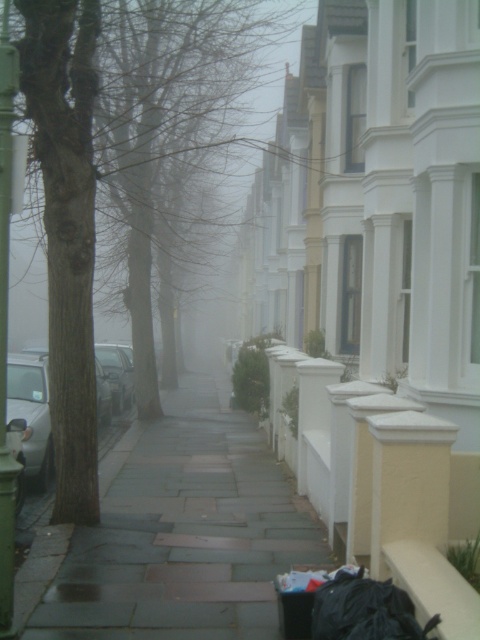
Question: Does dark gray stone pavement at center appear under brown rough tree at left?

Choices:
 (A) no
 (B) yes

Answer: (B)

Question: Is dark gray stone pavement at center in front of brown rough tree at left?

Choices:
 (A) no
 (B) yes

Answer: (A)

Question: Can you confirm if dark gray stone pavement at center is positioned to the right of brown rough tree at left?

Choices:
 (A) yes
 (B) no

Answer: (A)

Question: Which point is closer to the camera?

Choices:
 (A) (189, 552)
 (B) (51, 144)

Answer: (A)

Question: Which point appears farthest from the camera in this image?

Choices:
 (A) (235, 612)
 (B) (62, 224)

Answer: (B)

Question: Which point appears farthest from the camera in this image?

Choices:
 (A) (82, 403)
 (B) (127, 528)

Answer: (B)